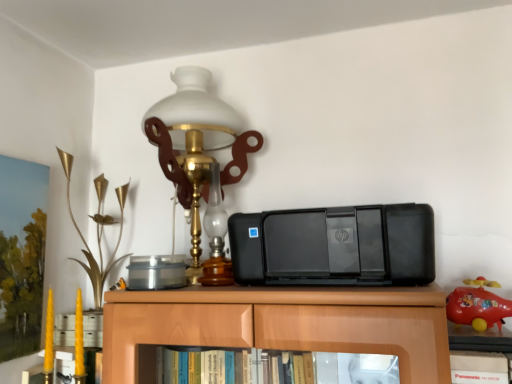
Question: Is point (190, 190) closer or farther from the camera than point (71, 163)?

Choices:
 (A) closer
 (B) farther

Answer: (A)

Question: In terms of height, does matte glass lamp at upper center look taller or shorter compared to gold metallic flower at left, the 2th toy from the right?

Choices:
 (A) short
 (B) tall

Answer: (B)

Question: Which is nearer to the gold metallic flower at left, the 2th toy from the right?

Choices:
 (A) matte glass lamp at upper center
 (B) black plastic printer at center
 (C) rubberized red toy airplane at right, marked as the 2th toy in a back-to-front arrangement
 (D) black plastic book at lower right

Answer: (A)

Question: Considering the real-world distances, which object is farthest from the matte glass lamp at upper center?

Choices:
 (A) black plastic book at lower right
 (B) black plastic printer at center
 (C) gold metallic flower at left, marked as the first toy in a back-to-front arrangement
 (D) rubberized red toy airplane at right, marked as the 1th toy in a front-to-back arrangement

Answer: (A)